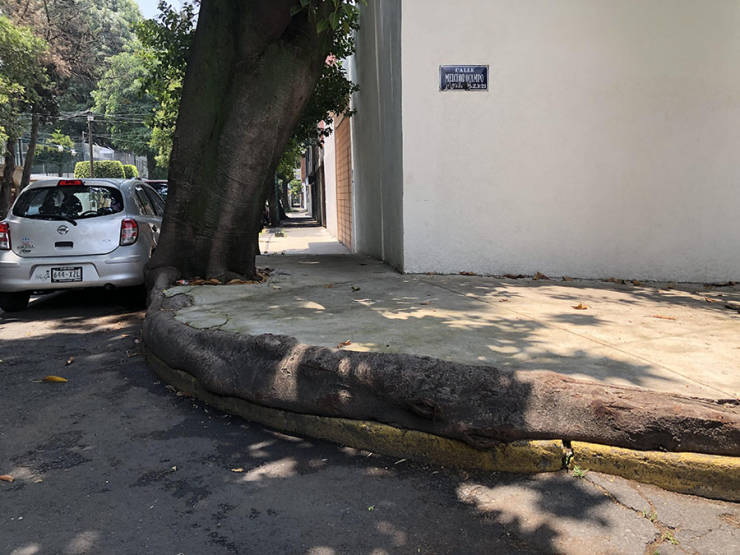
Identify the location of shaded wall. (382, 147).